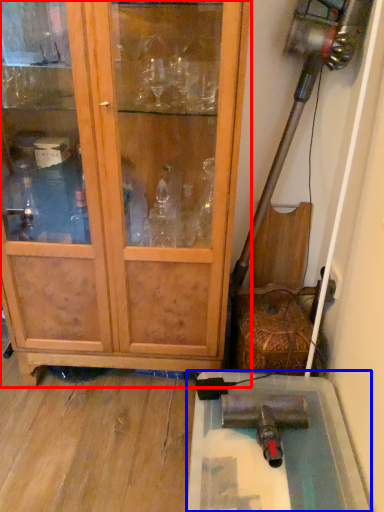
Question: Which point is further to the camera, cupboard (highlighted by a red box) or cabinetry (highlighted by a blue box)?

Choices:
 (A) cupboard
 (B) cabinetry

Answer: (B)